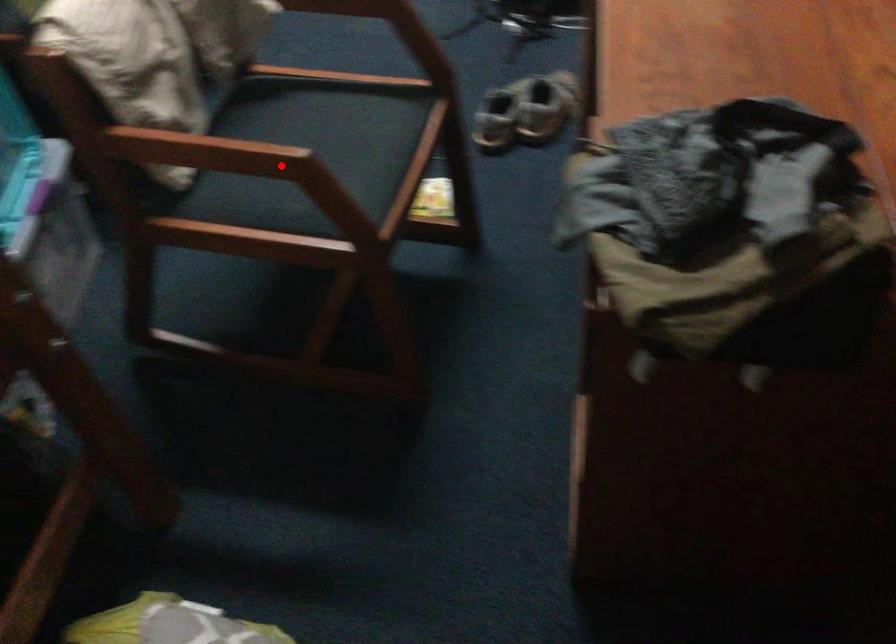
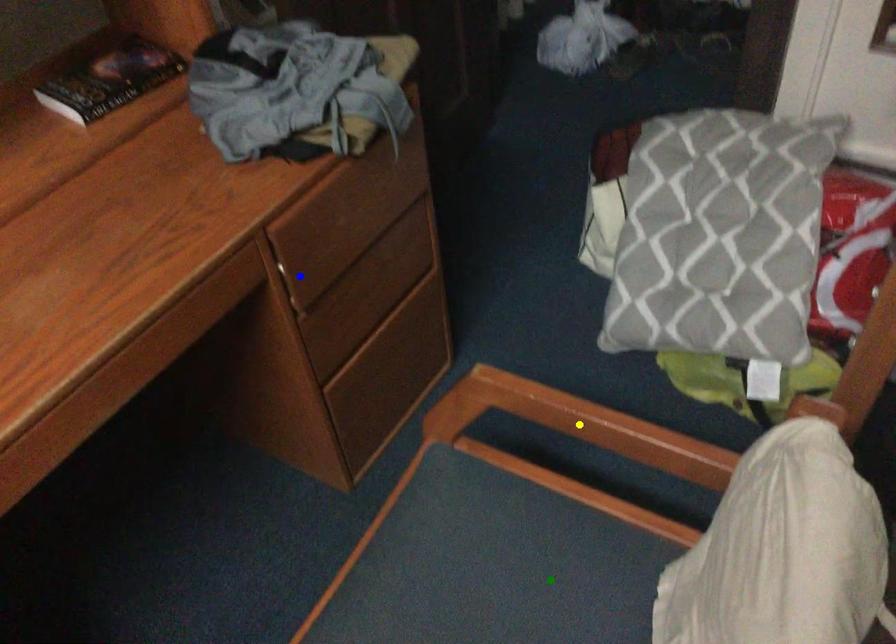
Question: I am providing you with two images of the same scene from different viewpoints. A red point is marked on the first image. You are given multiple points on the second image. Which spot in image 2 lines up with the point in image 1?

Choices:
 (A) blue point
 (B) yellow point
 (C) green point

Answer: (B)